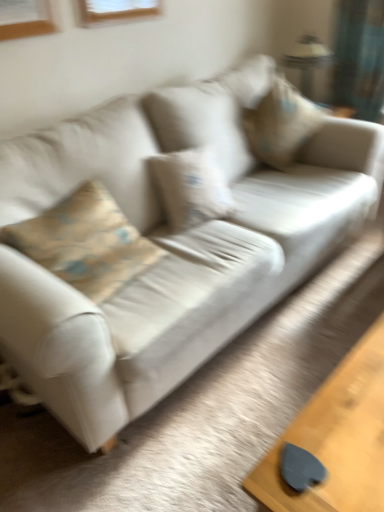
Question: From the image's perspective, is beige fabric pillow at upper right located beneath metallic silver lamp at upper right?

Choices:
 (A) no
 (B) yes

Answer: (B)

Question: Is beige fabric pillow at upper right outside of metallic silver lamp at upper right?

Choices:
 (A) no
 (B) yes

Answer: (B)

Question: Can you see beige fabric pillow at upper right touching metallic silver lamp at upper right?

Choices:
 (A) yes
 (B) no

Answer: (B)

Question: From a real-world perspective, is beige fabric pillow at upper right on metallic silver lamp at upper right?

Choices:
 (A) no
 (B) yes

Answer: (A)

Question: From a real-world perspective, is beige fabric pillow at upper right located beneath metallic silver lamp at upper right?

Choices:
 (A) no
 (B) yes

Answer: (B)

Question: Could metallic silver lamp at upper right be considered to be inside beige fabric pillow at upper right?

Choices:
 (A) yes
 (B) no

Answer: (B)

Question: Is beige fabric pillow at upper right smaller than smooth wooden table at lower right?

Choices:
 (A) no
 (B) yes

Answer: (A)

Question: Is beige fabric pillow at upper right closer to camera compared to smooth wooden table at lower right?

Choices:
 (A) yes
 (B) no

Answer: (B)

Question: Is beige fabric pillow at upper right positioned behind smooth wooden table at lower right?

Choices:
 (A) yes
 (B) no

Answer: (A)

Question: Would you say beige fabric pillow at upper right is outside smooth wooden table at lower right?

Choices:
 (A) no
 (B) yes

Answer: (B)

Question: From the image's perspective, is beige fabric pillow at upper right located beneath smooth wooden table at lower right?

Choices:
 (A) yes
 (B) no

Answer: (B)

Question: Is beige fabric pillow at upper right wider than smooth wooden table at lower right?

Choices:
 (A) yes
 (B) no

Answer: (A)

Question: Does smooth wooden table at lower right have a smaller size compared to metallic silver lamp at upper right?

Choices:
 (A) yes
 (B) no

Answer: (B)